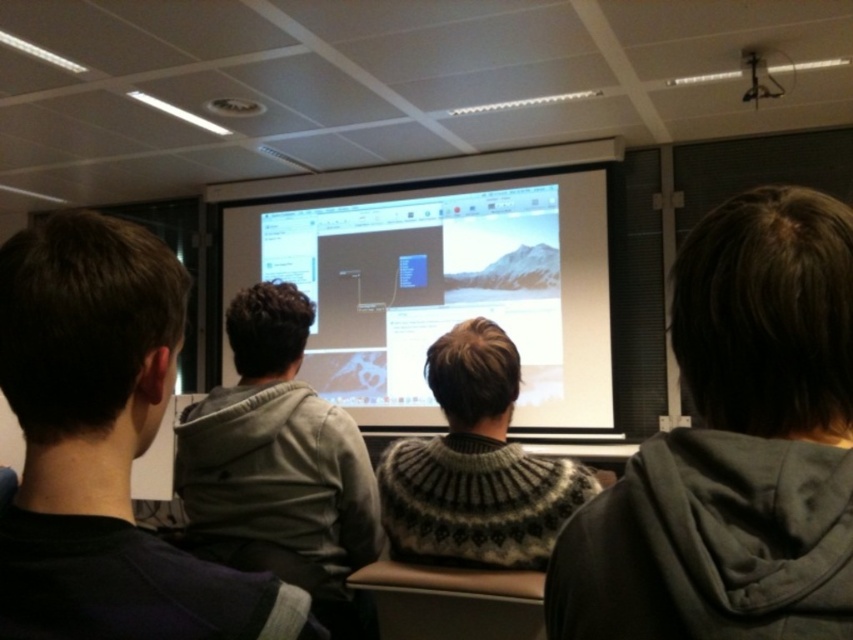
Question: Estimate the real-world distances between objects in this image. Which object is closer to the white glossy projection screen at center?

Choices:
 (A) gray hoodie at right
 (B) dark gray hoodie at left
 (C) gray fleece hoodie at center

Answer: (C)

Question: Is gray hoodie at right to the left of knitted sweater at center from the viewer's perspective?

Choices:
 (A) yes
 (B) no

Answer: (B)

Question: Which object is positioned closest to the dark gray hoodie at left?

Choices:
 (A) white glossy projection screen at center
 (B) gray hoodie at right
 (C) gray fleece hoodie at center
 (D) knitted sweater at center

Answer: (B)

Question: Considering the relative positions of gray hoodie at right and dark gray hoodie at left in the image provided, where is gray hoodie at right located with respect to dark gray hoodie at left?

Choices:
 (A) left
 (B) right

Answer: (B)

Question: Can you confirm if white glossy projection screen at center is positioned below gray fleece hoodie at center?

Choices:
 (A) no
 (B) yes

Answer: (A)

Question: Considering the real-world distances, which object is farthest from the dark gray hoodie at left?

Choices:
 (A) gray hoodie at right
 (B) gray fleece hoodie at center
 (C) knitted sweater at center

Answer: (B)